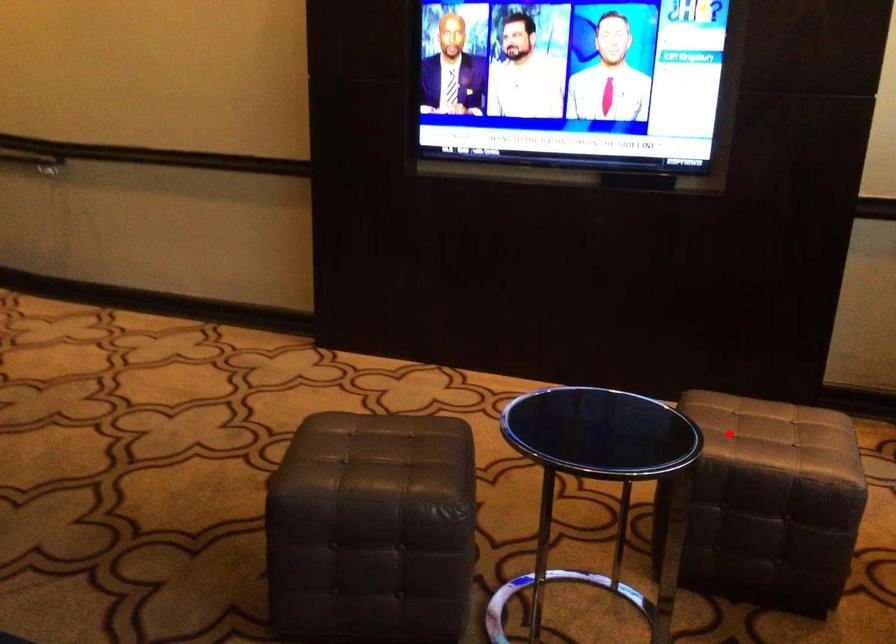
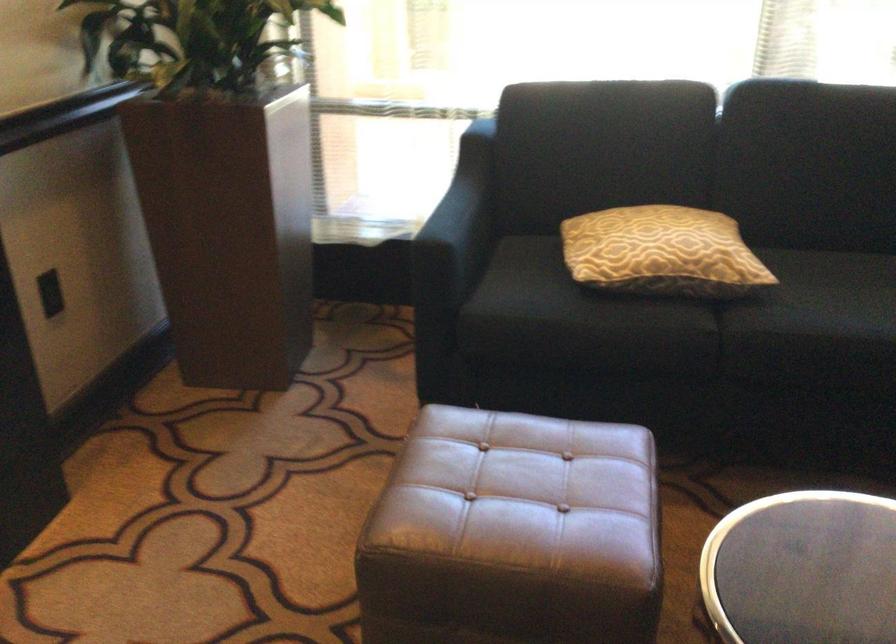
Where in the second image is the point corresponding to the highlighted location from the first image?

(522, 495)